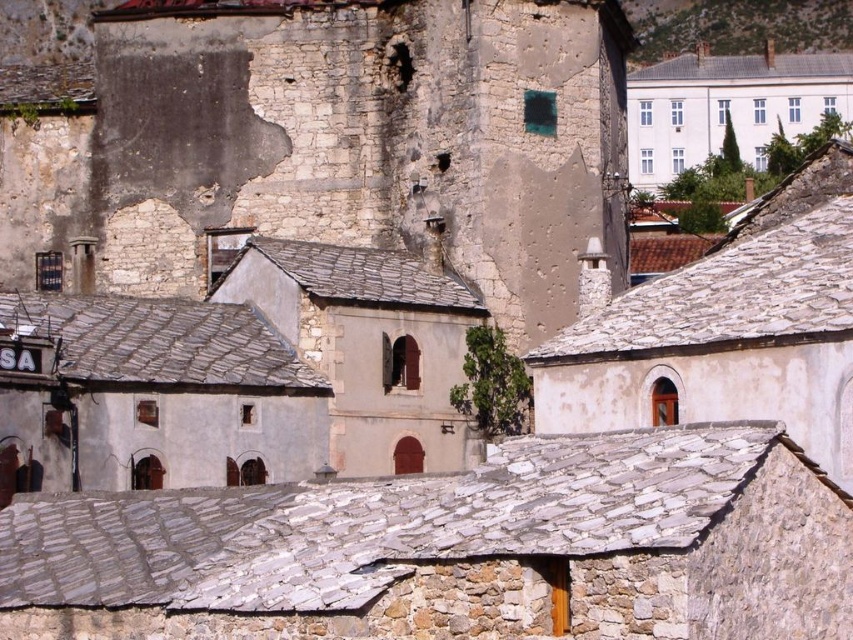
Who is higher up, white smooth building at upper right or green mossy hillside at upper right?

Positioned higher is green mossy hillside at upper right.

Is point (689, 113) less distant than point (831, 17)?

Yes, point (689, 113) is in front of point (831, 17).

Who is more distant from viewer, (679, 156) or (622, 1)?

The point (622, 1) is behind.

This screenshot has height=640, width=853. In order to click on white smooth building at upper right in this screenshot , I will do `click(726, 106)`.